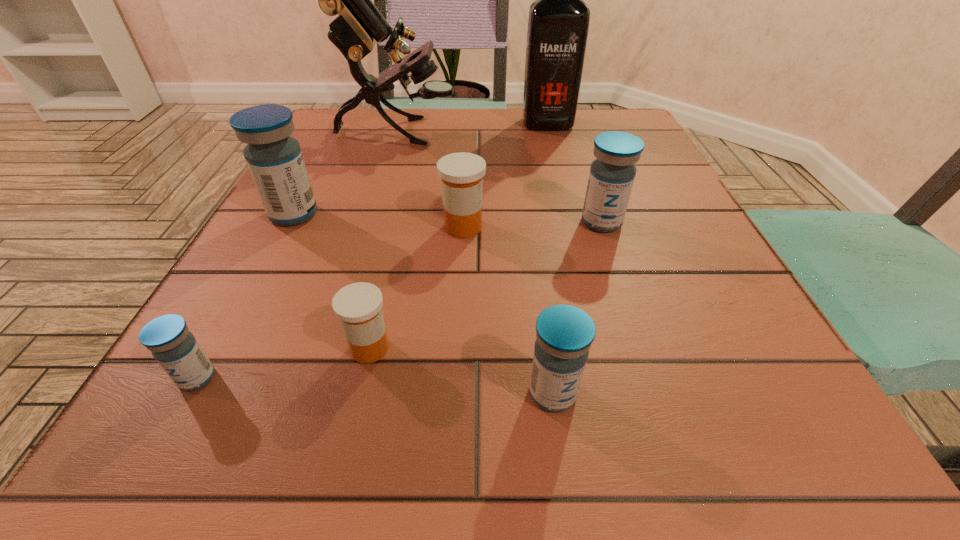
Identify the location of free space located on the back of the smallest blue medicine. (293, 205).

Locate an element on the screen. This screenshot has width=960, height=540. liquor located at the far edge is located at coordinates click(558, 23).

Where is `microscope that is at the far edge`? The image size is (960, 540). microscope that is at the far edge is located at coordinates (359, 25).

Locate an element on the screen. Image resolution: width=960 pixels, height=540 pixels. object that is at the near edge is located at coordinates (564, 334).

The width and height of the screenshot is (960, 540). I want to click on microscope that is at the left edge, so click(x=359, y=25).

Locate an element on the screen. Image resolution: width=960 pixels, height=540 pixels. liquor that is at the right edge is located at coordinates (558, 23).

Image resolution: width=960 pixels, height=540 pixels. What are the coordinates of `medicine present at the right edge` in the screenshot? It's located at (612, 174).

You are a GUI agent. You are given a task and a screenshot of the screen. Output one action in this format:
    pyautogui.click(x=<x>, y=<y>)
    Task: Click on the object that is at the far left corner
    
    Given the screenshot: What is the action you would take?
    pyautogui.click(x=359, y=25)

At what (x,y) coordinates should I click in order to perform the action: click on object present at the far right corner. Please return your answer as a coordinate pair (x, y). The image size is (960, 540). Looking at the image, I should click on (558, 23).

In the image, there is a desktop. At what (x,y) coordinates should I click in order to perform the action: click on vacant space at the far edge. Please return your answer as a coordinate pair (x, y). Looking at the image, I should click on (487, 133).